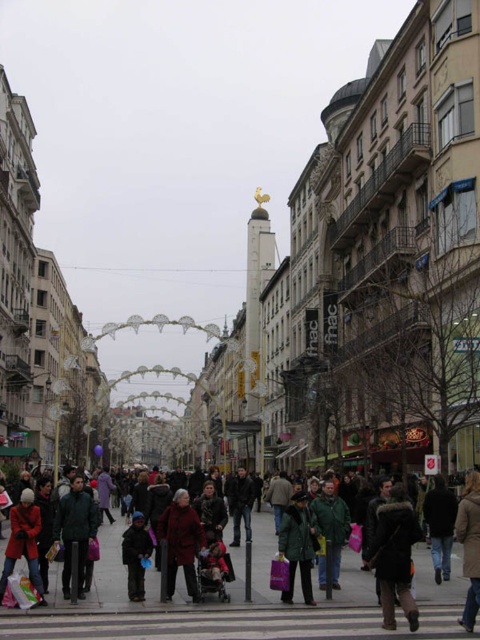
You are a delivery person carrying a package that is 1 meter wide. You are standing in the middle of the street and see the dark brown leather jacket at lower right and the translucent plastic bag at lower left. Can you determine if the space between these two items is wide enough to pass through with your package?

The dark brown leather jacket at lower right might be wider than the translucent plastic bag at lower left. Since the package is 1 meter wide, you should check the actual width of the space between them to ensure it can accommodate your package.